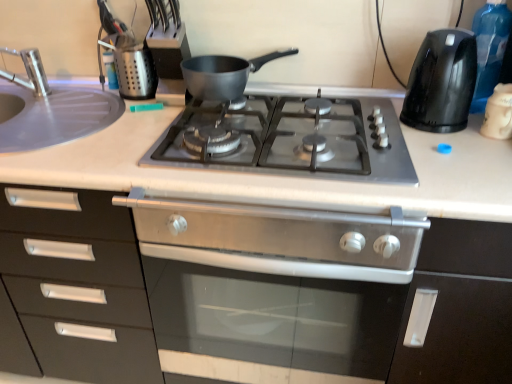
I want to click on free spot below black plastic kettle at right, the second kitchen appliance when ordered from right to left (from a real-world perspective), so click(438, 132).